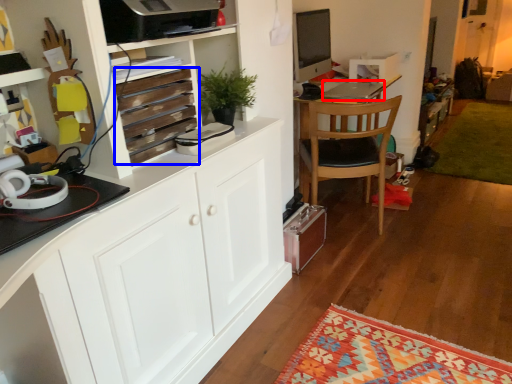
Question: Among these objects, which one is nearest to the camera, laptop (highlighted by a red box) or drawer (highlighted by a blue box)?

Choices:
 (A) laptop
 (B) drawer

Answer: (B)